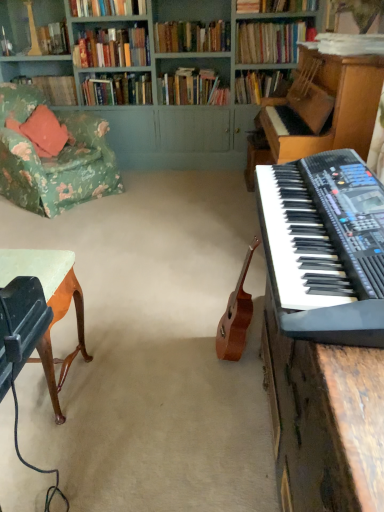
This screenshot has height=512, width=384. What do you see at coordinates (112, 48) in the screenshot? I see `hardcover books at upper left, the fifth book viewed from the back` at bounding box center [112, 48].

Where is `hardcover books at center, the 8th book when ordered from front to back`? The width and height of the screenshot is (384, 512). hardcover books at center, the 8th book when ordered from front to back is located at coordinates (192, 88).

The image size is (384, 512). Identify the location of hardcover books at upper center, the second book when ordered from back to front. (117, 89).

What do you see at coordinates (53, 158) in the screenshot? I see `floral fabric armchair at left` at bounding box center [53, 158].

Where is `black plastic keyboard at right`? black plastic keyboard at right is located at coordinates [324, 247].

From a real-world perspective, which is physically below, hardcover books at upper center, the fourth book viewed from the front, or white paper at upper right, the 1th book viewed from the front?

white paper at upper right, the 1th book viewed from the front, from a real-world perspective.

Could you measure the distance between hardcover books at upper center, the fourth book viewed from the front, and white paper at upper right, the 1th book viewed from the front?

7.48 feet.

Between hardcover books at upper center, the fourth book viewed from the front, and white paper at upper right, the 10th book positioned from the back, which one appears on the right side from the viewer's perspective?

Positioned to the right is white paper at upper right, the 10th book positioned from the back.

Is hardcover books at upper center, marked as the 7th book in a back-to-front arrangement, bigger than white paper at upper right, the 1th book viewed from the front?

Correct, hardcover books at upper center, marked as the 7th book in a back-to-front arrangement, is larger in size than white paper at upper right, the 1th book viewed from the front.

From a real-world perspective, is hardcover book at upper center, the 9th book when ordered from back to front, under hardcover books at upper center, the second book when ordered from back to front?

No, from a real-world perspective, hardcover book at upper center, the 9th book when ordered from back to front, is not below hardcover books at upper center, the second book when ordered from back to front.

Considering the sizes of hardcover book at upper center, the 9th book when ordered from back to front, and hardcover books at upper center, the second book when ordered from back to front, in the image, is hardcover book at upper center, the 9th book when ordered from back to front, wider or thinner than hardcover books at upper center, the second book when ordered from back to front,?

Clearly, hardcover book at upper center, the 9th book when ordered from back to front, has more width compared to hardcover books at upper center, the second book when ordered from back to front.

Which of these two, hardcover book at upper center, the second book when ordered from front to back, or hardcover books at upper center, which ranks as the ninth book in front-to-back order, is bigger?

hardcover books at upper center, which ranks as the ninth book in front-to-back order, is bigger.

Looking at this image, from the image's perspective, between hardcover book at upper center, the second book when ordered from front to back, and hardcover books at upper center, which ranks as the ninth book in front-to-back order, who is located below?

hardcover books at upper center, which ranks as the ninth book in front-to-back order, from the image's perspective.

Could you tell me if hardcover books at upper center, acting as the third book starting from the front, is facing hardcover book at upper left, the tenth book in the front-to-back sequence?

No, hardcover books at upper center, acting as the third book starting from the front, is not turned towards hardcover book at upper left, the tenth book in the front-to-back sequence.

Does hardcover books at upper center, which is the 8th book from back to front, have a greater width compared to hardcover book at upper left, arranged as the 1th book when viewed from the back?

Correct, the width of hardcover books at upper center, which is the 8th book from back to front, exceeds that of hardcover book at upper left, arranged as the 1th book when viewed from the back.

Between hardcover books at upper center, which is the 8th book from back to front, and hardcover book at upper left, the tenth book in the front-to-back sequence, which one appears on the left side from the viewer's perspective?

hardcover book at upper left, the tenth book in the front-to-back sequence, is more to the left.

Where is `the 2nd book above the hardcover book at upper left, the tenth book in the front-to-back sequence (from the image's perspective)`? The image size is (384, 512). the 2nd book above the hardcover book at upper left, the tenth book in the front-to-back sequence (from the image's perspective) is located at coordinates (268, 42).

Starting from the hardcover books at center, which appears as the 3th book when viewed from the back, which book is the 6th one in front? Please provide its 2D coordinates.

[(275, 6)]

Considering the relative sizes of hardcover books at center, the 8th book when ordered from front to back, and hardcover book at upper center, the second book when ordered from front to back, in the image provided, is hardcover books at center, the 8th book when ordered from front to back, taller than hardcover book at upper center, the second book when ordered from front to back,?

Yes, hardcover books at center, the 8th book when ordered from front to back, is taller than hardcover book at upper center, the second book when ordered from front to back.

Between point (220, 103) and point (264, 8), which one is positioned behind?

The point (220, 103) is behind.

Is hardcover books at center, the 8th book when ordered from front to back, far away from hardcover book at upper center, the second book when ordered from front to back?

They are positioned close to each other.

Is point (257, 77) closer to camera compared to point (67, 104)?

That is True.

Who is bigger, hardcover book at upper center, marked as the 7th book in a front-to-back arrangement, or hardcover book at upper left, the tenth book in the front-to-back sequence?

hardcover book at upper center, marked as the 7th book in a front-to-back arrangement.

Does hardcover book at upper center, marked as the 7th book in a front-to-back arrangement, have a lesser height compared to hardcover book at upper left, arranged as the 1th book when viewed from the back?

No.

Which object is further away from the camera, hardcover book at upper center, marked as the 7th book in a front-to-back arrangement, or hardcover book at upper left, arranged as the 1th book when viewed from the back?

hardcover book at upper left, arranged as the 1th book when viewed from the back, is further away from the camera.

From the image's perspective, is light brown wood desk at lower left on white paper at upper right, the 10th book positioned from the back?

No, from the image's perspective, light brown wood desk at lower left is not above white paper at upper right, the 10th book positioned from the back.

Is light brown wood desk at lower left at the left side of white paper at upper right, the 10th book positioned from the back?

Yes, light brown wood desk at lower left is to the left of white paper at upper right, the 10th book positioned from the back.

Is light brown wood desk at lower left oriented away from white paper at upper right, the 1th book viewed from the front?

light brown wood desk at lower left is not turned away from white paper at upper right, the 1th book viewed from the front.

Looking at this image, is hardcover book at upper center, marked as the 7th book in a front-to-back arrangement, shorter than hardcover books at upper center, the fourth book viewed from the front?

In fact, hardcover book at upper center, marked as the 7th book in a front-to-back arrangement, may be taller than hardcover books at upper center, the fourth book viewed from the front.

Does hardcover book at upper center, marked as the 7th book in a front-to-back arrangement, turn towards hardcover books at upper center, the fourth book viewed from the front?

Result: No, hardcover book at upper center, marked as the 7th book in a front-to-back arrangement, does not turn towards hardcover books at upper center, the fourth book viewed from the front.

From the image's perspective, between hardcover book at upper center, the 4th book positioned from the back, and hardcover books at upper center, the fourth book viewed from the front, who is located below?

From the image's view, hardcover book at upper center, the 4th book positioned from the back, is below.

Is point (238, 95) closer to camera compared to point (103, 2)?

No, it is behind (103, 2).

This screenshot has height=512, width=384. What are the coordinates of `the 3rd book behind the white paper at upper right, the 10th book positioned from the back` in the screenshot? It's located at (107, 8).

From the hardcover books at upper center, the second book when ordered from back to front, count 7th books forward and point to it. Please provide its 2D coordinates.

[(275, 6)]

Estimate the real-world distances between objects in this image. Which object is further from hardcover book at upper center, marked as the 7th book in a front-to-back arrangement, hardcover books at upper center, marked as the 7th book in a back-to-front arrangement, or light brown wood desk at lower left?

The object further to hardcover book at upper center, marked as the 7th book in a front-to-back arrangement, is light brown wood desk at lower left.

Which object lies nearer to the anchor point hardcover books at center, the 8th book when ordered from front to back, hardcover books at upper center, marked as the 7th book in a back-to-front arrangement, or hardcover book at upper left, the tenth book in the front-to-back sequence?

hardcover books at upper center, marked as the 7th book in a back-to-front arrangement, is positioned closer to the anchor hardcover books at center, the 8th book when ordered from front to back.

Estimate the real-world distances between objects in this image. Which object is further from hardcover book at upper left, the tenth book in the front-to-back sequence, black plastic keyboard at right or hardcover books at upper center, the fourth book viewed from the front?

black plastic keyboard at right is further to hardcover book at upper left, the tenth book in the front-to-back sequence.

Which object lies further to the anchor point hardcover books at upper center, which appears as the 5th book when viewed from the front, black plastic keyboard at right or hardcover book at upper center, the 4th book positioned from the back?

black plastic keyboard at right is further to hardcover books at upper center, which appears as the 5th book when viewed from the front.

From the image, which object appears to be farther from black plastic keyboard at right, hardcover books at upper center, which ranks as the ninth book in front-to-back order, or wooden bookshelf at upper left?

Among the two, wooden bookshelf at upper left is located further to black plastic keyboard at right.

Looking at the image, which one is located further to hardcover books at upper left, the fifth book viewed from the back, hardcover book at upper center, the 4th book positioned from the back, or light brown wood desk at lower left?

light brown wood desk at lower left.

Looking at the image, which one is located further to hardcover book at upper left, arranged as the 1th book when viewed from the back, hardcover books at upper center, which appears as the 5th book when viewed from the front, or hardcover books at upper center, acting as the third book starting from the front?

hardcover books at upper center, acting as the third book starting from the front, is positioned further to the anchor hardcover book at upper left, arranged as the 1th book when viewed from the back.

From the image, which object appears to be nearer to light brown wood desk at lower left, black plastic keyboard at right or hardcover books at upper center, the fourth book viewed from the front?

black plastic keyboard at right is positioned closer to the anchor light brown wood desk at lower left.

Find the location of a particular element. The image size is (384, 512). chair between black plastic keyboard at right and wooden bookshelf at upper left in the front-back direction is located at coordinates (53, 158).

Locate an element on the screen. This screenshot has height=512, width=384. bookcase between light brown wood desk at lower left and wooden bookshelf at upper left in the front-back direction is located at coordinates (172, 106).

The width and height of the screenshot is (384, 512). What are the coordinates of `chair between light brown wood desk at lower left and green painted wood bookcase at upper center from front to back` in the screenshot? It's located at (53, 158).

You are a GUI agent. You are given a task and a screenshot of the screen. Output one action in this format:
    pyautogui.click(x=<x>, y=<y>)
    Task: Click on the chair situated between hardcover book at upper left, the tenth book in the front-to-back sequence, and hardcover books at upper center, the sixth book from the back, from left to right
    This screenshot has width=384, height=512.
    Given the screenshot: What is the action you would take?
    pyautogui.click(x=53, y=158)